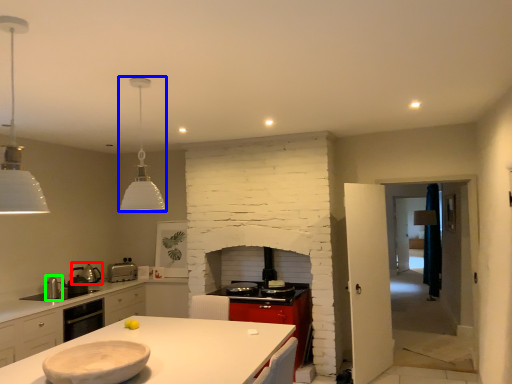
Question: Which object is the farthest from appliance (highlighted by a red box)? Choose among these: light fixture (highlighted by a blue box) or appliance (highlighted by a green box).

Choices:
 (A) light fixture
 (B) appliance

Answer: (A)